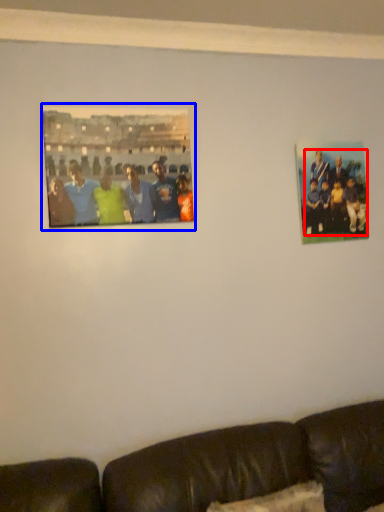
Question: Which object is further to the camera taking this photo, person (highlighted by a red box) or picture frame (highlighted by a blue box)?

Choices:
 (A) person
 (B) picture frame

Answer: (A)